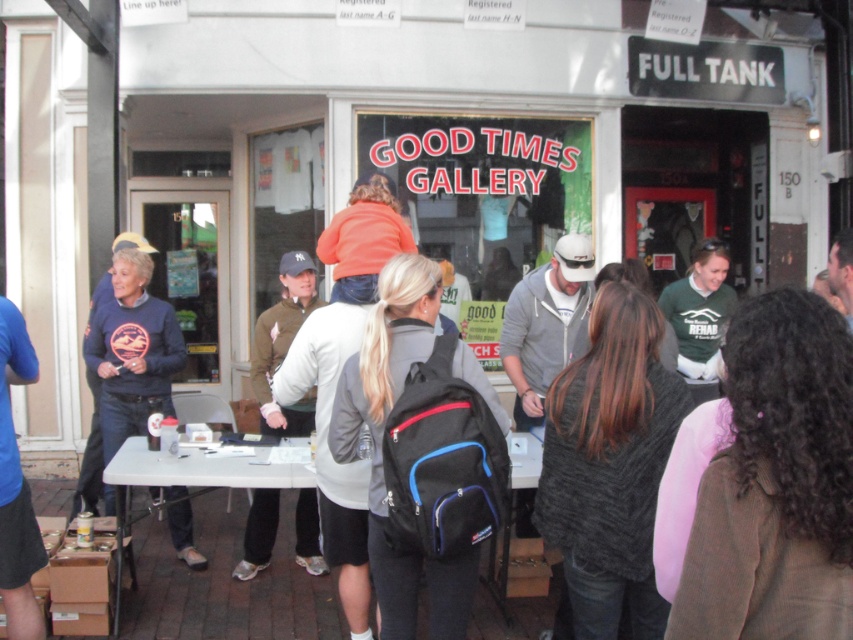
Question: Which of the following is the farthest from the observer?

Choices:
 (A) dark gray sweater at center
 (B) green cotton shirt at right
 (C) black synthetic backpack at center
 (D) khaki cotton jacket at center

Answer: (D)

Question: Which point appears closest to the camera in this image?

Choices:
 (A) (512, 486)
 (B) (160, 337)
 (C) (693, 252)

Answer: (A)

Question: Is dark gray sweater at center below green matte shirt at center?

Choices:
 (A) no
 (B) yes

Answer: (B)

Question: Which object appears farthest from the camera in this image?

Choices:
 (A) black synthetic backpack at center
 (B) dark gray sweater at center

Answer: (A)

Question: Can you confirm if navy blue sweater at left is smaller than khaki cotton jacket at center?

Choices:
 (A) no
 (B) yes

Answer: (A)

Question: Does black synthetic backpack at center have a lesser width compared to khaki cotton jacket at center?

Choices:
 (A) yes
 (B) no

Answer: (B)